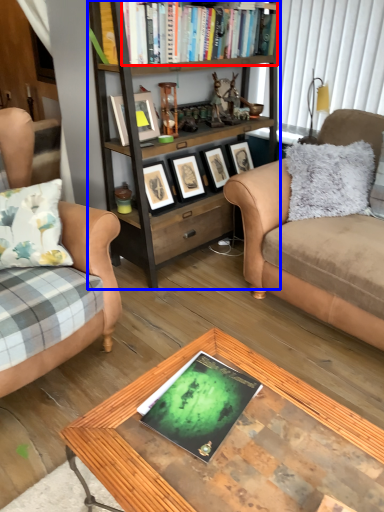
Question: Among these objects, which one is nearest to the camera, book (highlighted by a red box) or bookcase (highlighted by a blue box)?

Choices:
 (A) book
 (B) bookcase

Answer: (B)